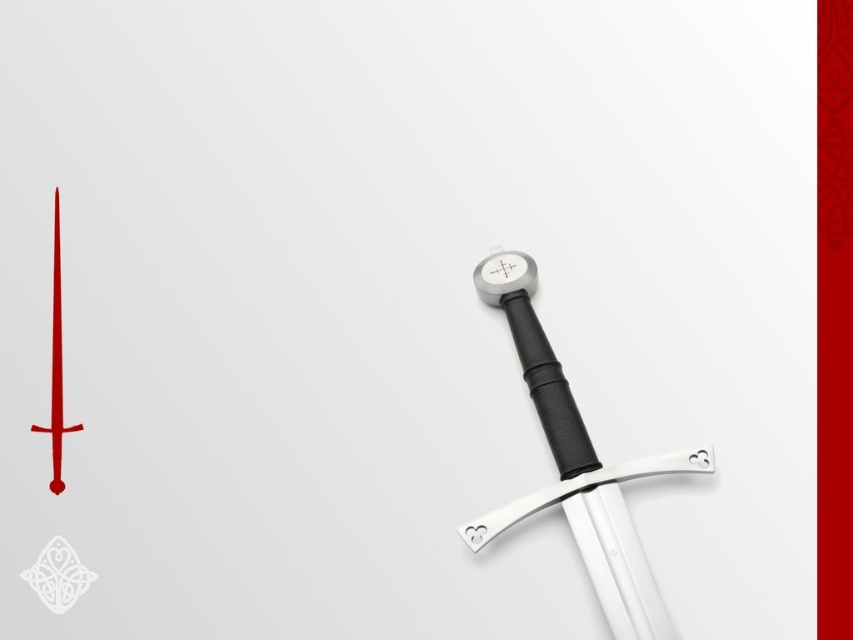
Which is more to the right, polished silver sword at center-right or polished silver sword at right?

polished silver sword at center-right is more to the right.

Is polished silver sword at center-right taller than polished silver sword at right?

Yes, polished silver sword at center-right is taller than polished silver sword at right.

Find the location of a particular element. This screenshot has width=853, height=640. polished silver sword at center-right is located at coordinates (576, 467).

You are a GUI agent. You are given a task and a screenshot of the screen. Output one action in this format:
    pyautogui.click(x=<x>, y=<y>)
    Task: Click on the polished silver sword at center-right
    Image resolution: width=853 pixels, height=640 pixels.
    Given the screenshot: What is the action you would take?
    pyautogui.click(x=576, y=467)